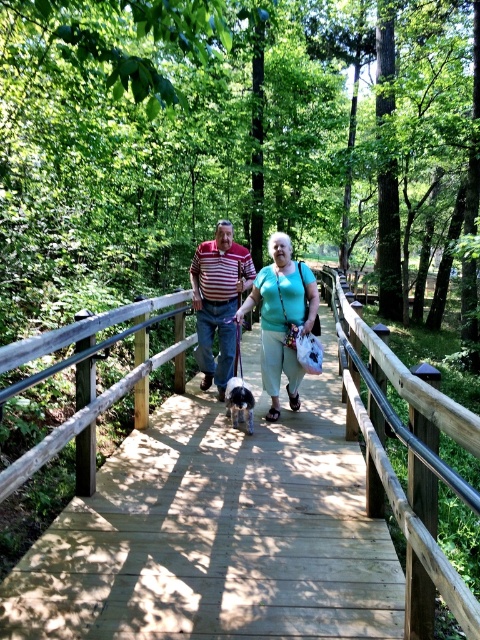
You are standing at the origin point of the coordinate system in the image. The wooden bridge at center is located at point [235,534]. If you want to walk towards the wooden bridge at center, in which direction should you move?

The wooden bridge at center is located at point [235,534]. Since you are at the origin, you should move towards the positive x and positive y directions to reach the wooden bridge at center.

You are a photographer standing on the wooden bridge. You want to take a photo of the striped cotton shirt at center and the fluffy white dog at center. The minimum distance required between subjects for your camera to focus properly is 1 meter. Will the camera focus correctly?

The distance between the striped cotton shirt at center and the fluffy white dog at center is 87.95 centimeters, which is less than 1 meter. Therefore, the camera may struggle to focus properly due to the insufficient distance between the subjects.

You are a photographer planning to capture a wide shot of the wooden bridge at center and the fluffy white dog at center. Given that the camera can only focus on one object at a time, which object should you prioritize to ensure it is in focus if you want the larger object to be clear?

The wooden bridge at center is larger in size than the fluffy white dog at center, so you should prioritize focusing on the wooden bridge at center to ensure the larger object is clear.